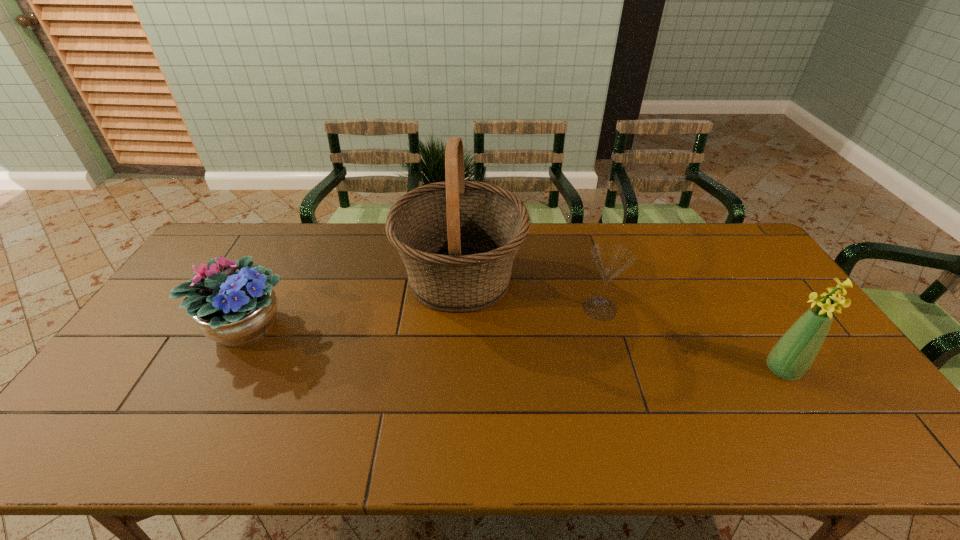
The height and width of the screenshot is (540, 960). I want to click on the third closest object to the flute glass, so click(235, 309).

Locate an element on the screen. The image size is (960, 540). object that is the closest one to the rightmost object is located at coordinates (611, 259).

The width and height of the screenshot is (960, 540). What are the coordinates of `vacant point that satisfies the following two spatial constraints: 1. on the back side of the flute glass; 2. on the right side of the left bouquet` in the screenshot? It's located at (254, 308).

Where is `vacant space that satisfies the following two spatial constraints: 1. on the back side of the shorter bouquet; 2. on the left side of the basket`? vacant space that satisfies the following two spatial constraints: 1. on the back side of the shorter bouquet; 2. on the left side of the basket is located at coordinates (271, 279).